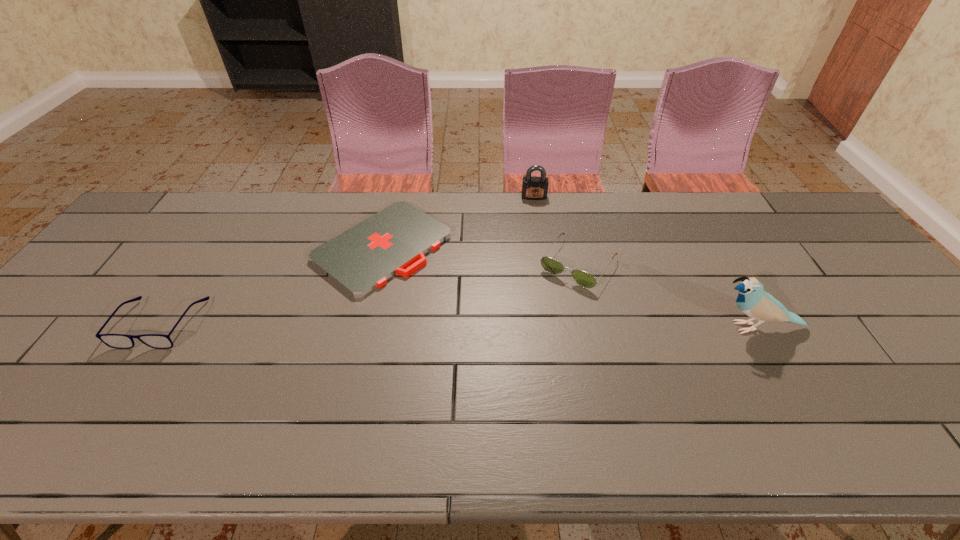
At what (x,y) coordinates should I click in order to perform the action: click on spectacles. Please return your answer as a coordinate pair (x, y). Looking at the image, I should click on (118, 341).

Locate an element on the screen. This screenshot has width=960, height=540. the rightmost object is located at coordinates (752, 299).

Image resolution: width=960 pixels, height=540 pixels. I want to click on bird, so click(x=752, y=299).

Where is `sunglasses`? This screenshot has height=540, width=960. sunglasses is located at coordinates (584, 279).

Where is `padlock`? padlock is located at coordinates (533, 188).

The height and width of the screenshot is (540, 960). I want to click on the farthest object, so click(533, 188).

This screenshot has width=960, height=540. In order to click on the first-aid kit in this screenshot , I will do `click(363, 258)`.

You are a GUI agent. You are given a task and a screenshot of the screen. Output one action in this format:
    pyautogui.click(x=<x>, y=<y>)
    Task: Click on the shortest object
    
    Given the screenshot: What is the action you would take?
    pyautogui.click(x=363, y=258)

Find the location of `blank area located on the front-facing side of the spectacles`. blank area located on the front-facing side of the spectacles is located at coordinates (112, 399).

Find the location of a particular element. free space located at the face of the bird is located at coordinates (672, 327).